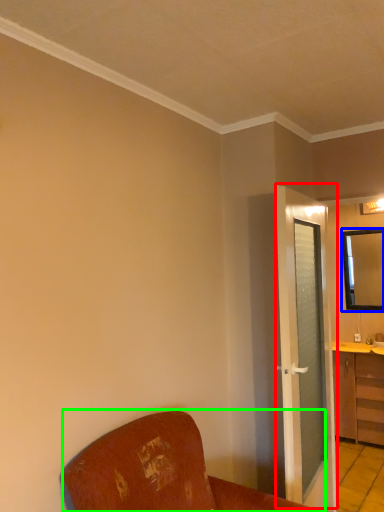
Question: Which is farther away from door (highlighted by a red box)? mirror (highlighted by a blue box) or furniture (highlighted by a green box)?

Choices:
 (A) mirror
 (B) furniture

Answer: (A)